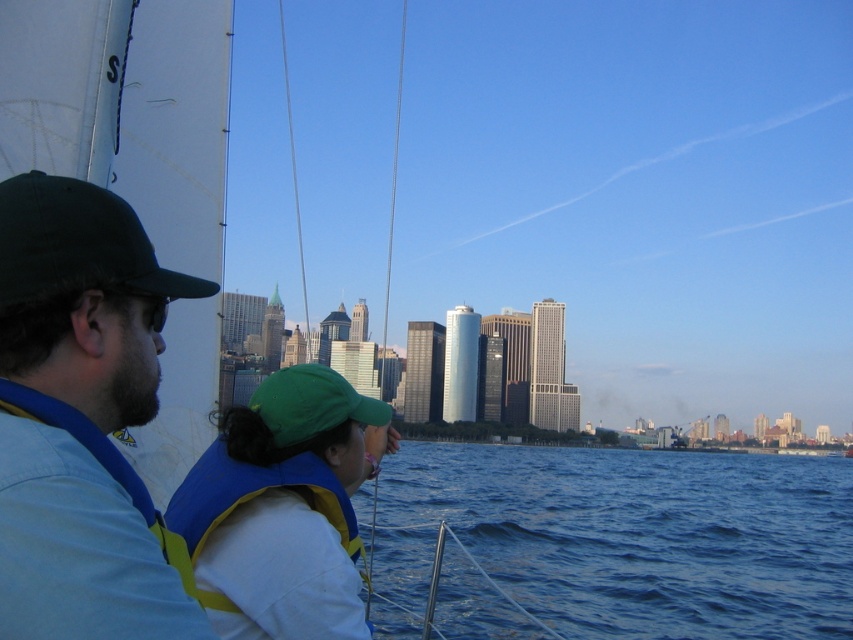
Who is taller, blue water at lower center or green fabric baseball cap at left?

Standing taller between the two is blue water at lower center.

Does point (675, 605) come behind point (49, 212)?

Yes, point (675, 605) is behind point (49, 212).

Find the location of a particular element. blue water at lower center is located at coordinates (625, 538).

Who is lower down, green fabric cap at center or green fabric baseball cap at left?

green fabric cap at center

Between green fabric cap at center and green fabric baseball cap at left, which one has more height?

green fabric cap at center is taller.

The height and width of the screenshot is (640, 853). I want to click on green fabric cap at center, so click(x=282, y=508).

Does dark green fabric cap at left appear on the right side of green fabric cap at center?

Incorrect, dark green fabric cap at left is not on the right side of green fabric cap at center.

Can you confirm if dark green fabric cap at left is wider than green fabric cap at center?

Yes.

The image size is (853, 640). What do you see at coordinates (82, 298) in the screenshot? I see `dark green fabric cap at left` at bounding box center [82, 298].

Locate an element on the screen. The width and height of the screenshot is (853, 640). dark green fabric cap at left is located at coordinates (82, 298).